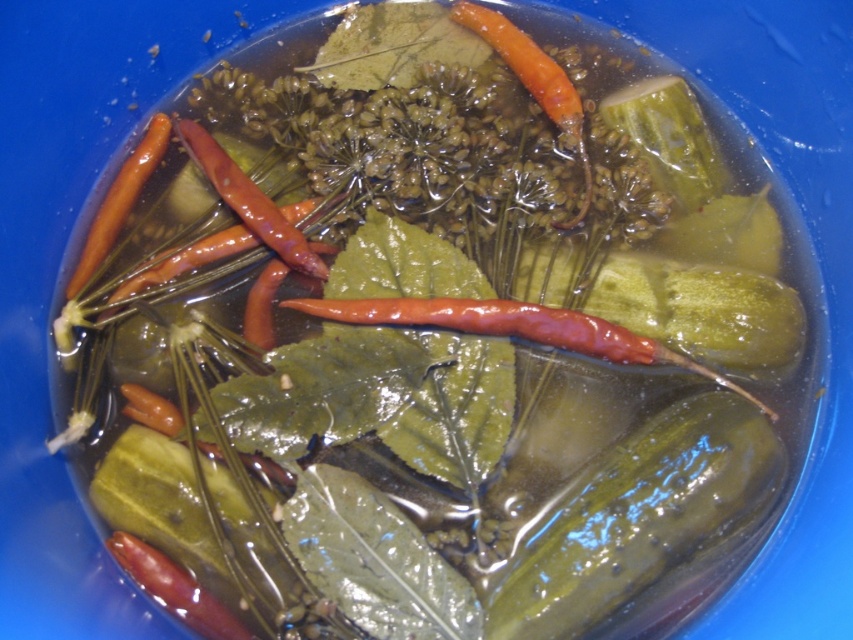
You are looking at a bowl of pickled vegetables. There is a point at coordinate (634,516). What is located at that point?

The point at coordinate (634,516) is on a green glossy pickle at center.

You are preparing a snack and want to choose the larger vegetable between the green glossy pickle at center and the orange glossy carrot at upper left. Which one should you pick?

The green glossy pickle at center is bigger than the orange glossy carrot at upper left, so you should pick the green glossy pickle at center.